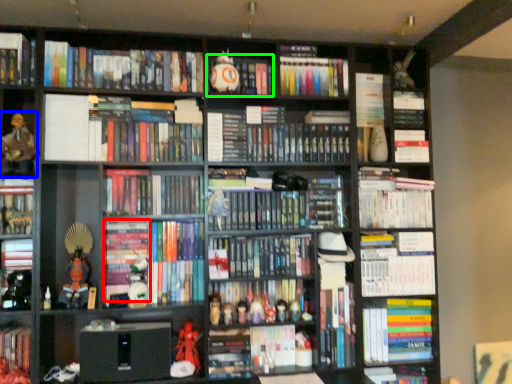
Question: Estimate the real-world distances between objects in this image. Which object is farther from book (highlighted by a red box), person (highlighted by a blue box) or book (highlighted by a green box)?

Choices:
 (A) person
 (B) book

Answer: (B)